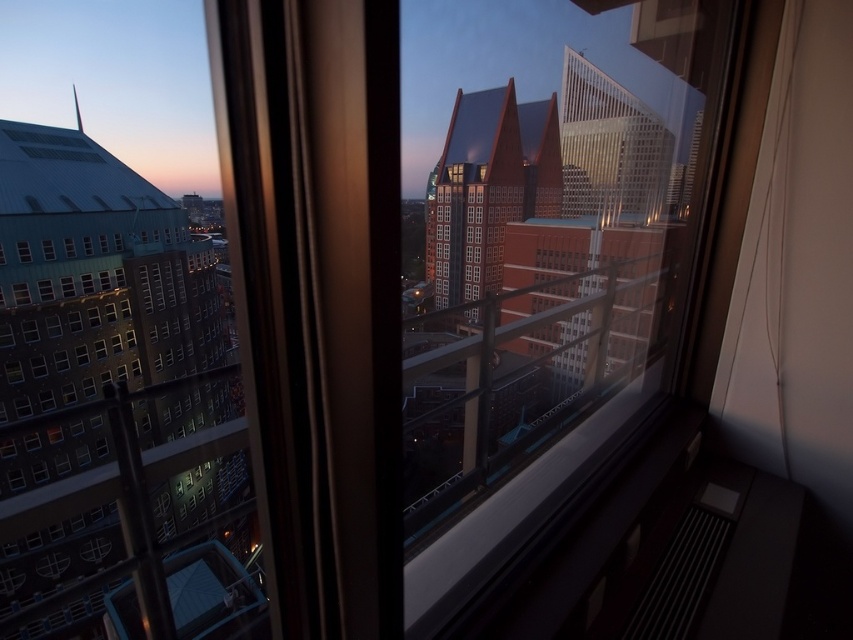
Question: Which point appears closest to the camera in this image?

Choices:
 (A) (44, 244)
 (B) (16, 246)

Answer: (B)

Question: Can you confirm if transparent glass window at lower left is smaller than transparent glass window at center?

Choices:
 (A) no
 (B) yes

Answer: (A)

Question: Among these objects, which one is farthest from the camera?

Choices:
 (A) transparent glass window at lower left
 (B) transparent glass window at center

Answer: (B)

Question: Is transparent glass window at lower left in front of transparent glass window at center?

Choices:
 (A) no
 (B) yes

Answer: (B)

Question: Is transparent glass window at lower left in front of transparent glass window at center?

Choices:
 (A) no
 (B) yes

Answer: (B)